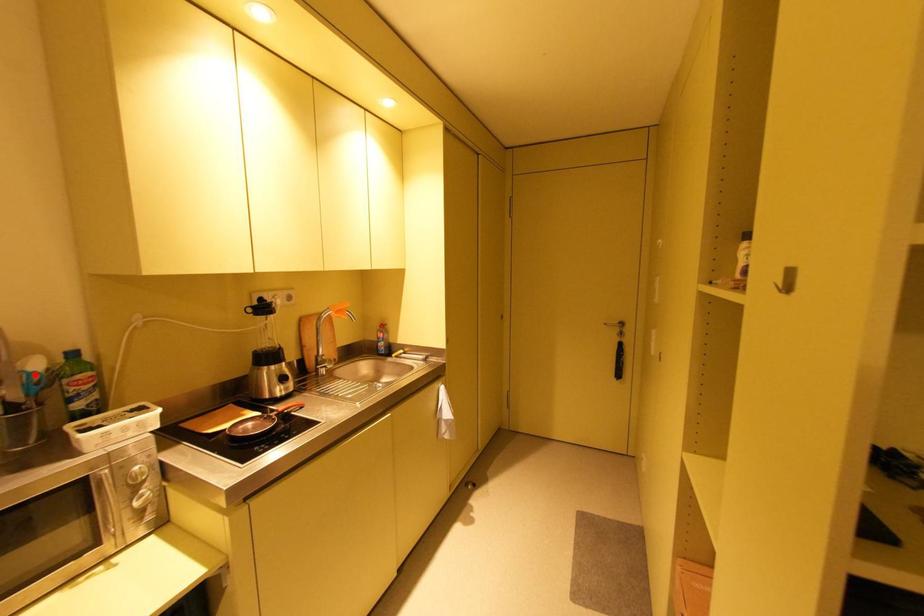
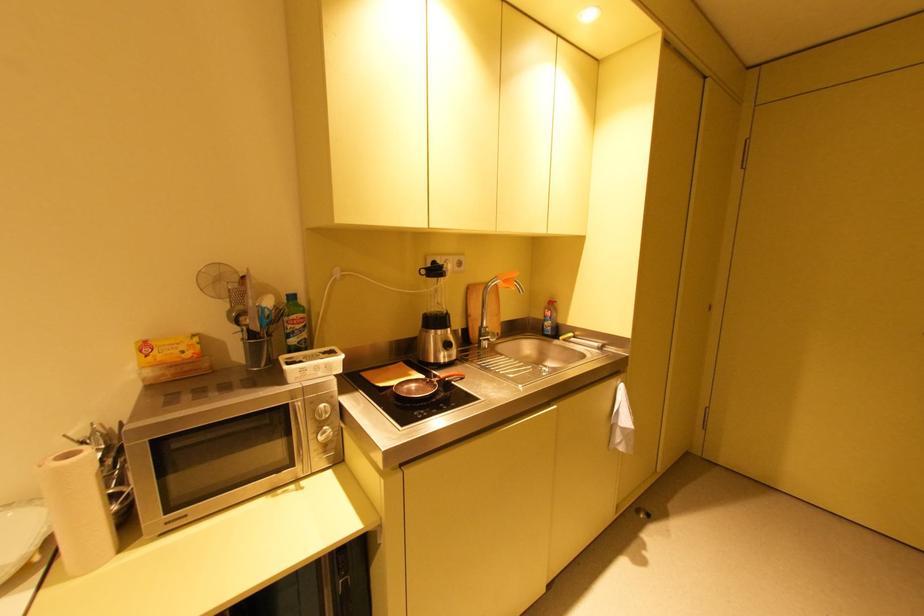
Where in the second image is the point corresponding to the highlighted location from the first image?

(268, 310)